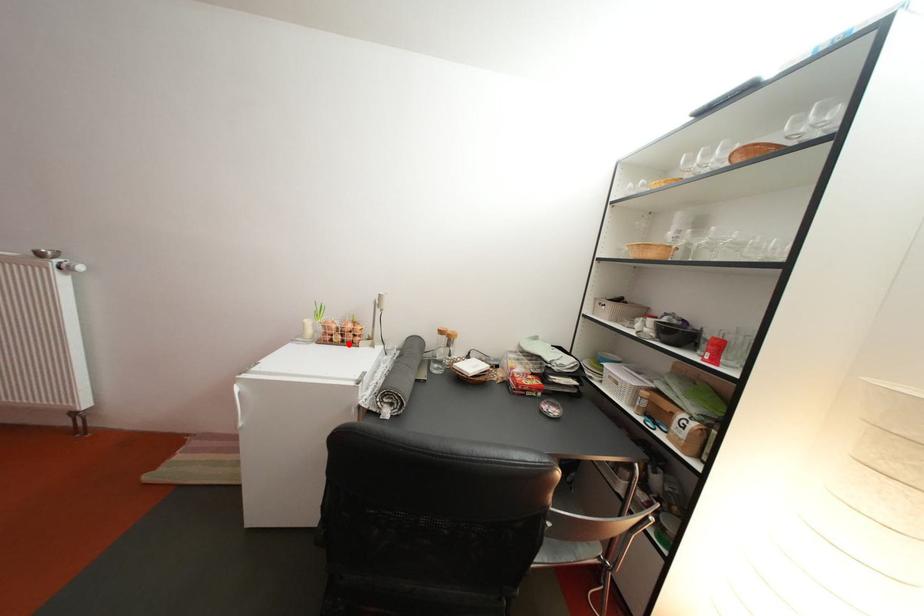
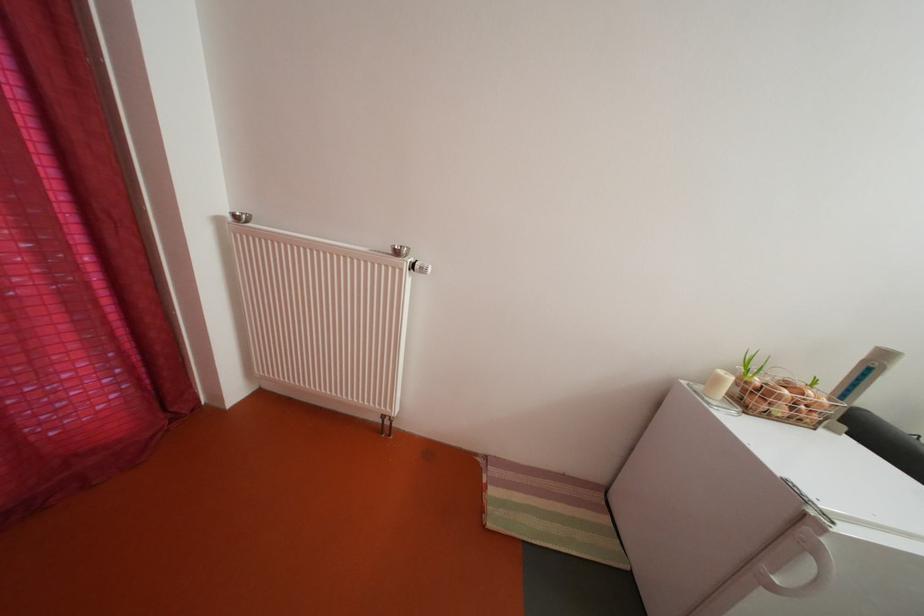
Locate, in the second image, the point that corresponds to the highlighted location in the first image.

(792, 416)